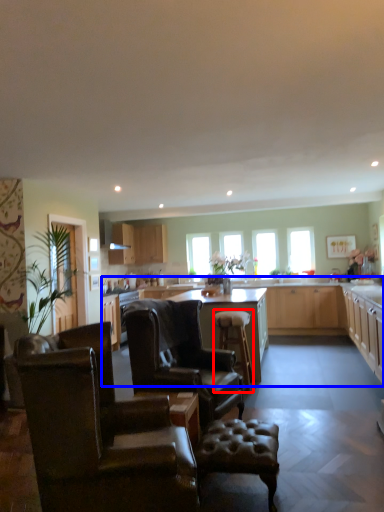
Question: Which of the following is the closest to the observer, bar stool (highlighted by a red box) or countertop (highlighted by a blue box)?

Choices:
 (A) bar stool
 (B) countertop

Answer: (B)